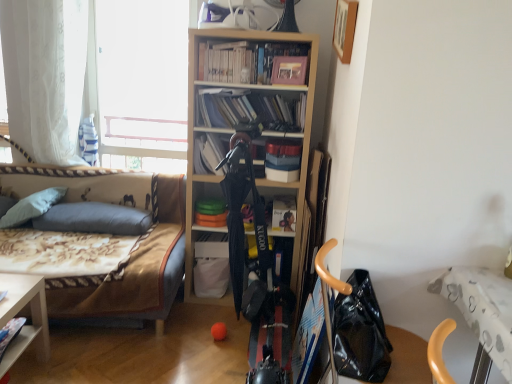
This screenshot has height=384, width=512. What are the coordinates of `vacant location behind orange matte ball at center` in the screenshot? It's located at (226, 321).